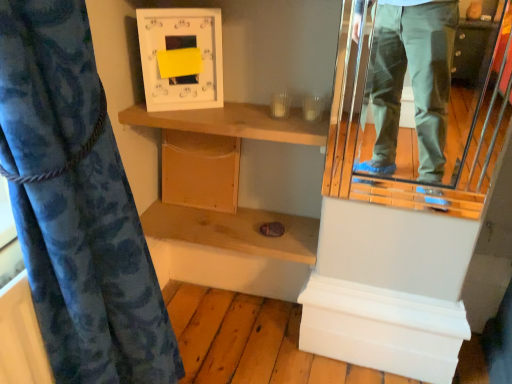
The image size is (512, 384). What do you see at coordinates (234, 123) in the screenshot?
I see `wooden shelf at upper center, positioned as the first shelf in top-to-bottom order` at bounding box center [234, 123].

The width and height of the screenshot is (512, 384). What do you see at coordinates (200, 170) in the screenshot? I see `wooden cabinet at center` at bounding box center [200, 170].

Locate an element on the screen. blue floral fabric at left is located at coordinates (94, 274).

Would you say blue floral fabric at left is outside wooden cabinet at center?

Yes.

Does blue floral fabric at left appear on the left side of wooden cabinet at center?

Yes.

Which object is thinner, blue floral fabric at left or wooden cabinet at center?

With smaller width is wooden cabinet at center.

Considering the sizes of objects blue floral fabric at left and wooden cabinet at center in the image provided, who is shorter, blue floral fabric at left or wooden cabinet at center?

wooden cabinet at center is shorter.

Does wooden shelf at upper center, acting as the 2th shelf starting from the bottom, lie in front of wooden shelf at center, acting as the second shelf starting from the top?

Yes.

From the image's perspective, is wooden shelf at upper center, acting as the 2th shelf starting from the bottom, above or below wooden shelf at center, acting as the second shelf starting from the top?

wooden shelf at upper center, acting as the 2th shelf starting from the bottom, is situated higher than wooden shelf at center, acting as the second shelf starting from the top, in the image.

Could you tell me if wooden shelf at upper center, positioned as the first shelf in top-to-bottom order, is facing wooden shelf at center, acting as the second shelf starting from the top?

No, wooden shelf at upper center, positioned as the first shelf in top-to-bottom order, does not turn towards wooden shelf at center, acting as the second shelf starting from the top.

From the picture: Based on their sizes in the image, would you say metallic reflective mirror at right is bigger or smaller than wooden shelf at center, acting as the second shelf starting from the top?

Clearly, metallic reflective mirror at right is smaller in size than wooden shelf at center, acting as the second shelf starting from the top.

Does point (373, 93) appear closer or farther from the camera than point (309, 243)?

Point (373, 93) appears to be farther away from the viewer than point (309, 243).

Is metallic reflective mirror at right behind wooden shelf at center, acting as the second shelf starting from the top?

No, the depth of metallic reflective mirror at right is less than that of wooden shelf at center, acting as the second shelf starting from the top.

From the image's perspective, which object appears higher, metallic reflective mirror at right or wooden shelf at center, placed as the first shelf when sorted from bottom to top?

metallic reflective mirror at right, from the image's perspective.

Locate an element on the screen. curtain that appears in front of the wooden shelf at upper center, positioned as the first shelf in top-to-bottom order is located at coordinates (94, 274).

Between blue floral fabric at left and wooden shelf at upper center, positioned as the first shelf in top-to-bottom order, which one has less height?

Standing shorter between the two is wooden shelf at upper center, positioned as the first shelf in top-to-bottom order.

Between blue floral fabric at left and wooden shelf at upper center, acting as the 2th shelf starting from the bottom, which one has smaller size?

wooden shelf at upper center, acting as the 2th shelf starting from the bottom, is smaller.

From the image's perspective, relative to metallic reflective mirror at right, is blue floral fabric at left above or below?

Clearly, from the image's perspective, blue floral fabric at left is below metallic reflective mirror at right.

Does blue floral fabric at left appear on the right side of metallic reflective mirror at right?

In fact, blue floral fabric at left is to the left of metallic reflective mirror at right.

Which of these two, blue floral fabric at left or metallic reflective mirror at right, is thinner?

Thinner between the two is metallic reflective mirror at right.

Can you tell me how much wooden cabinet at center and wooden shelf at upper center, acting as the 2th shelf starting from the bottom, differ in facing direction?

wooden cabinet at center and wooden shelf at upper center, acting as the 2th shelf starting from the bottom, are facing 0.847 degrees away from each other.

Which object is wider, wooden cabinet at center or wooden shelf at upper center, positioned as the first shelf in top-to-bottom order?

Wider between the two is wooden shelf at upper center, positioned as the first shelf in top-to-bottom order.

Could you tell me if wooden cabinet at center is turned towards wooden shelf at upper center, positioned as the first shelf in top-to-bottom order?

No, wooden cabinet at center is not turned towards wooden shelf at upper center, positioned as the first shelf in top-to-bottom order.

Is wooden cabinet at center completely or partially outside of wooden shelf at center, acting as the second shelf starting from the top?

wooden cabinet at center lies outside wooden shelf at center, acting as the second shelf starting from the top,'s area.

How distant is wooden cabinet at center from wooden shelf at center, acting as the second shelf starting from the top?

wooden cabinet at center is 5.83 inches away from wooden shelf at center, acting as the second shelf starting from the top.

Is wooden cabinet at center positioned with its back to wooden shelf at center, acting as the second shelf starting from the top?

No.

In terms of size, does wooden cabinet at center appear bigger or smaller than wooden shelf at center, acting as the second shelf starting from the top?

Clearly, wooden cabinet at center is smaller in size than wooden shelf at center, acting as the second shelf starting from the top.

Locate an element on the screen. The height and width of the screenshot is (384, 512). cabinet directly beneath the blue floral fabric at left (from a real-world perspective) is located at coordinates (200, 170).

Locate an element on the screen. The height and width of the screenshot is (384, 512). shelf that is below the wooden shelf at upper center, positioned as the first shelf in top-to-bottom order (from the image's perspective) is located at coordinates (234, 230).

Looking at the image, which one is located closer to metallic reflective mirror at right, wooden shelf at center, acting as the second shelf starting from the top, or wooden cabinet at center?

Among the two, wooden shelf at center, acting as the second shelf starting from the top, is located nearer to metallic reflective mirror at right.

Which object lies nearer to the anchor point wooden cabinet at center, wooden shelf at center, placed as the first shelf when sorted from bottom to top, or metallic reflective mirror at right?

Based on the image, wooden shelf at center, placed as the first shelf when sorted from bottom to top, appears to be nearer to wooden cabinet at center.

Based on their spatial positions, is wooden shelf at center, acting as the second shelf starting from the top, or wooden shelf at upper center, acting as the 2th shelf starting from the bottom, closer to blue floral fabric at left?

wooden shelf at upper center, acting as the 2th shelf starting from the bottom, is positioned closer to the anchor blue floral fabric at left.

From the image, which object appears to be farther from blue floral fabric at left, wooden shelf at center, placed as the first shelf when sorted from bottom to top, or wooden cabinet at center?

Based on the image, wooden cabinet at center appears to be further to blue floral fabric at left.

Based on their spatial positions, is wooden shelf at upper center, acting as the 2th shelf starting from the bottom, or wooden cabinet at center further from metallic reflective mirror at right?

Based on the image, wooden shelf at upper center, acting as the 2th shelf starting from the bottom, appears to be further to metallic reflective mirror at right.

When comparing their distances from wooden shelf at upper center, acting as the 2th shelf starting from the bottom, does metallic reflective mirror at right or blue floral fabric at left seem closer?

Based on the image, blue floral fabric at left appears to be nearer to wooden shelf at upper center, acting as the 2th shelf starting from the bottom.

Estimate the real-world distances between objects in this image. Which object is further from blue floral fabric at left, wooden shelf at center, placed as the first shelf when sorted from bottom to top, or metallic reflective mirror at right?

metallic reflective mirror at right lies further to blue floral fabric at left than the other object.

Looking at the image, which one is located further to wooden cabinet at center, wooden shelf at upper center, acting as the 2th shelf starting from the bottom, or metallic reflective mirror at right?

metallic reflective mirror at right is further to wooden cabinet at center.

I want to click on mirror between blue floral fabric at left and wooden shelf at center, placed as the first shelf when sorted from bottom to top, from front to back, so click(411, 126).

The image size is (512, 384). I want to click on cabinet between wooden shelf at upper center, positioned as the first shelf in top-to-bottom order, and wooden shelf at center, placed as the first shelf when sorted from bottom to top, in the up-down direction, so click(200, 170).

Locate an element on the screen. This screenshot has height=384, width=512. mirror located between blue floral fabric at left and wooden cabinet at center in the depth direction is located at coordinates (411, 126).

You are a GUI agent. You are given a task and a screenshot of the screen. Output one action in this format:
    pyautogui.click(x=<x>, y=<y>)
    Task: Click on the shelf situated between wooden shelf at upper center, acting as the 2th shelf starting from the bottom, and metallic reflective mirror at right from left to right
    Image resolution: width=512 pixels, height=384 pixels.
    Given the screenshot: What is the action you would take?
    pyautogui.click(x=234, y=230)